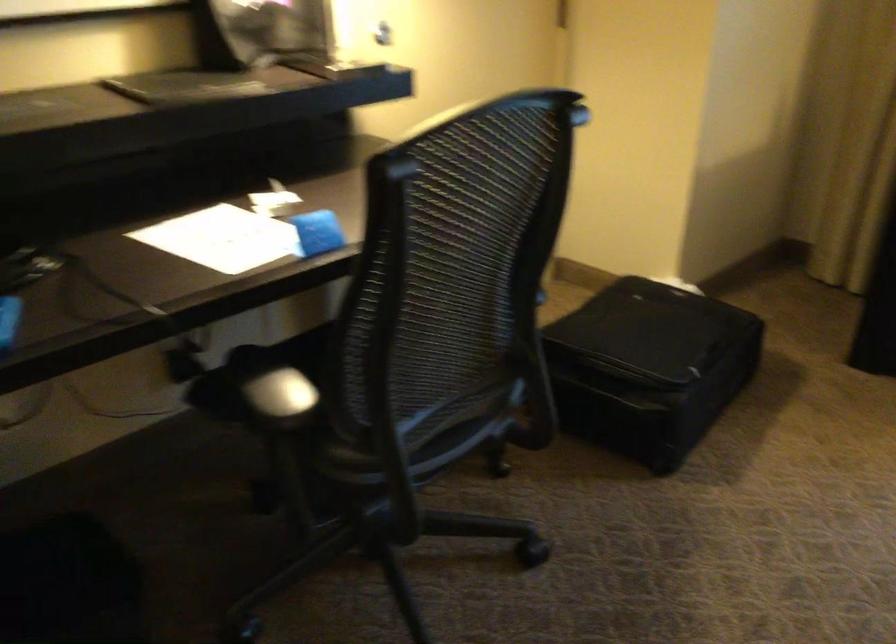
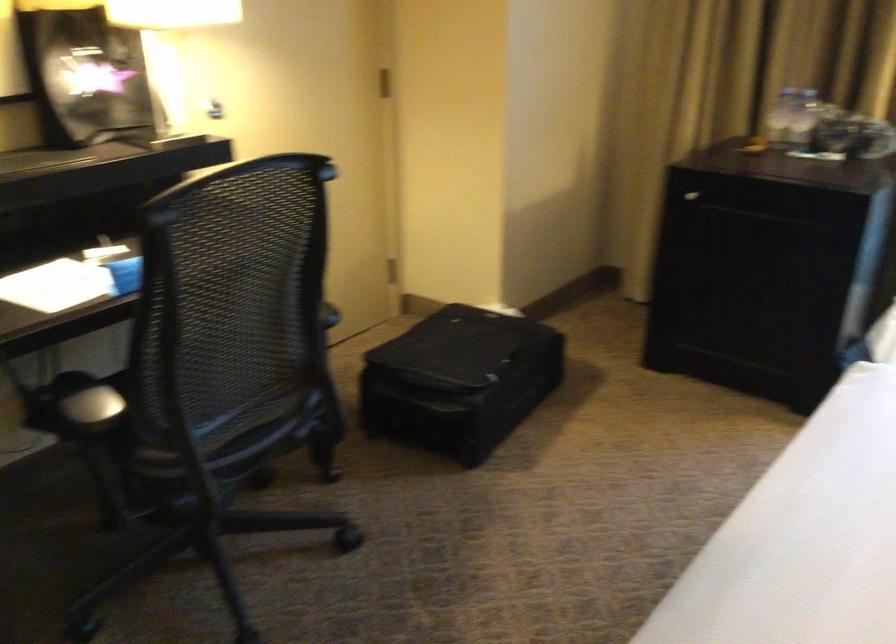
Question: The camera is either moving clockwise (left) or counter-clockwise (right) around the object. The first image is from the beginning of the video and the second image is from the end. Is the camera moving left or right when shooting the video?

Choices:
 (A) Left
 (B) Right

Answer: (A)